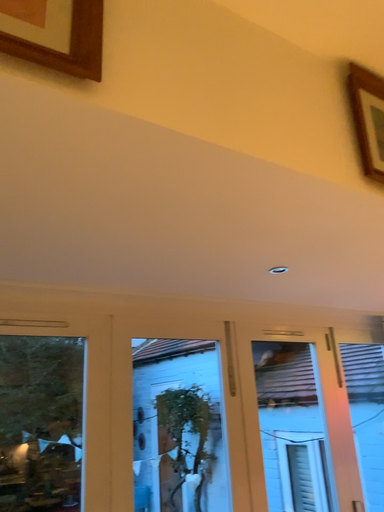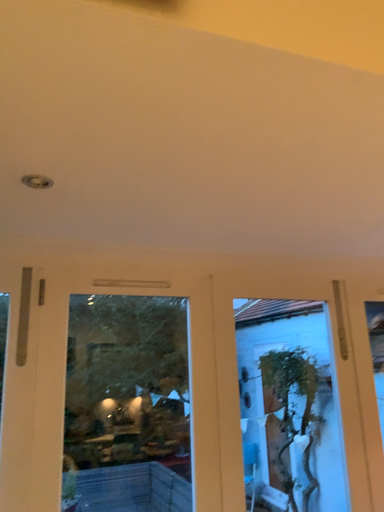
Question: Which way did the camera rotate in the video?

Choices:
 (A) rotated right
 (B) rotated left

Answer: (B)